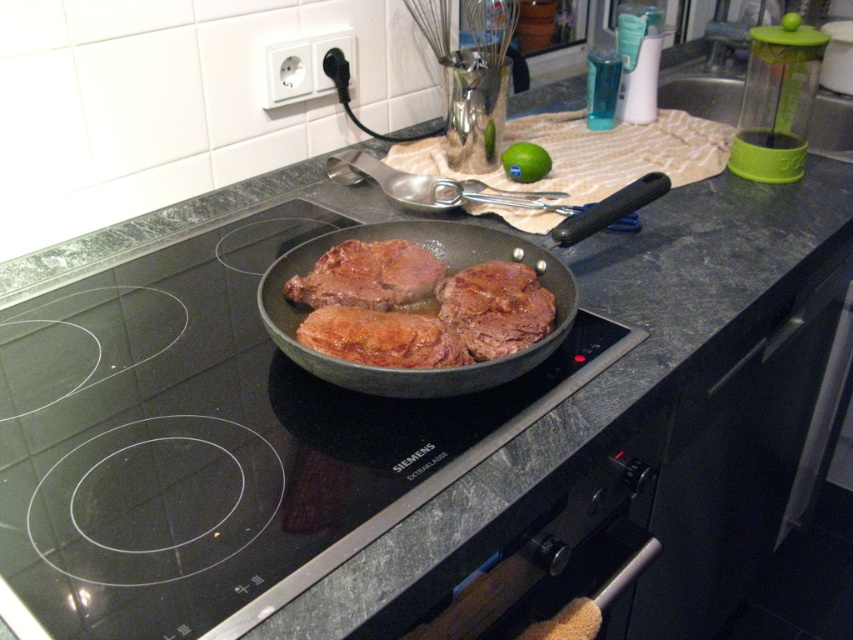
Who is positioned more to the right, brown glossy steak at center or brown crispy meat at center?

brown crispy meat at center is more to the right.

Describe the element at coordinates (368, 276) in the screenshot. I see `brown glossy steak at center` at that location.

Find the location of a particular element. The width and height of the screenshot is (853, 640). brown glossy steak at center is located at coordinates (368, 276).

Identify the location of brown glossy steak at center. (368, 276).

Is point (389, 376) behind point (450, 307)?

No, (389, 376) is in front of (450, 307).

Is shiny black frying pan at center positioned in front of brown matte meat at center?

Yes, shiny black frying pan at center is closer to the viewer.

Does point (474, 244) come farther from viewer compared to point (485, 358)?

That is True.

This screenshot has height=640, width=853. Find the location of `shiny black frying pan at center`. shiny black frying pan at center is located at coordinates (450, 269).

Can you confirm if brown matte meat at center is positioned below green matte lime at upper center?

Yes, brown matte meat at center is below green matte lime at upper center.

Does point (526, 278) come closer to viewer compared to point (538, 150)?

Yes, it is in front of point (538, 150).

Who is more forward, (x=466, y=324) or (x=509, y=173)?

Point (x=466, y=324) is in front.

I want to click on brown matte meat at center, so pyautogui.click(x=495, y=308).